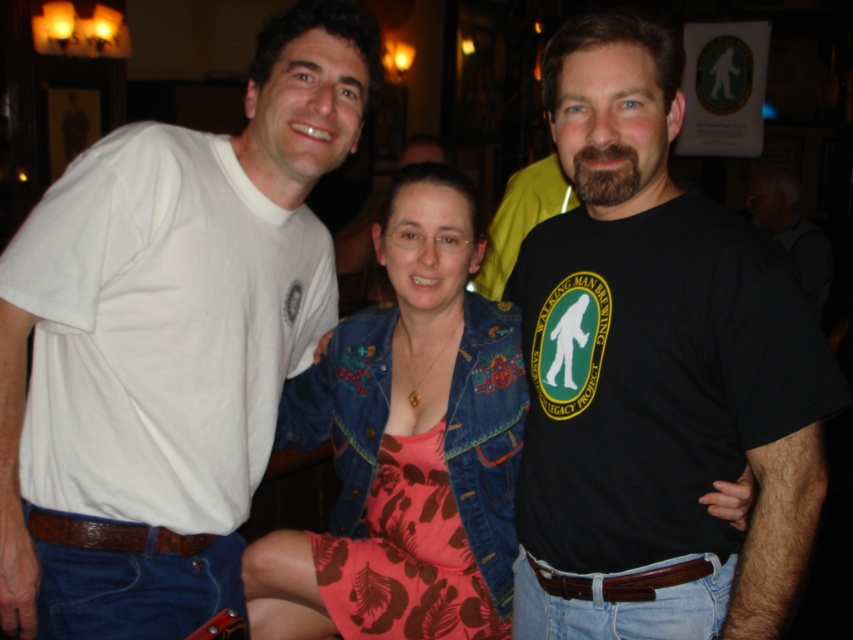
You are standing at the point marked as point (776, 449) in the image. You want to take a photo of the three people in the scene. Since the camera you have can only focus on objects within 1.5 meters, will the three people be in focus?

The distance of point (776, 449) from camera is 1.28 meters, so yes, the three people will be in focus because they are within the camera focus range of 1.5 meters.

You are standing in the image and want to touch the point at coordinates (x=169, y=336). Which object from the scene will your finger land on?

The point at coordinates (x=169, y=336) is located on the white t shirt at left, so your finger will land on the white t shirt at left.